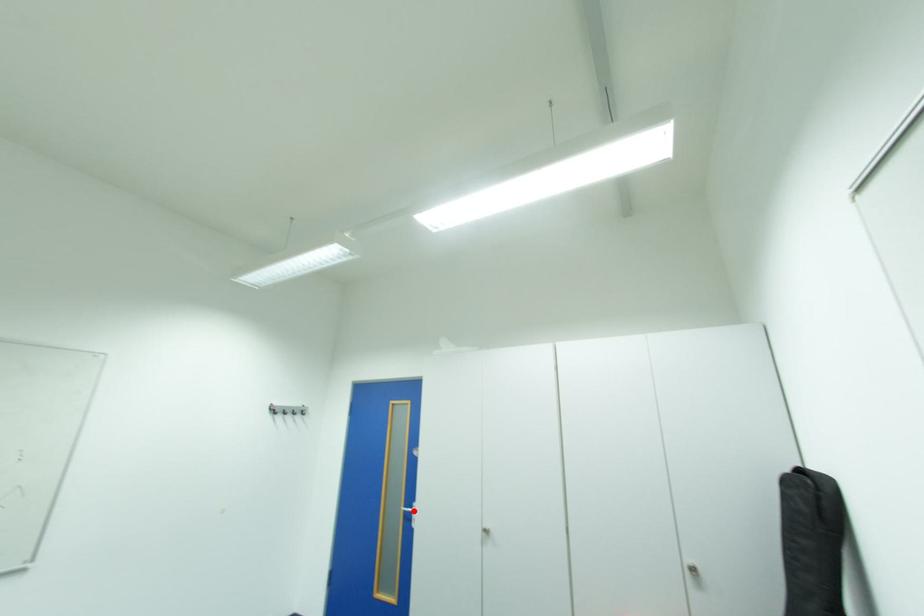
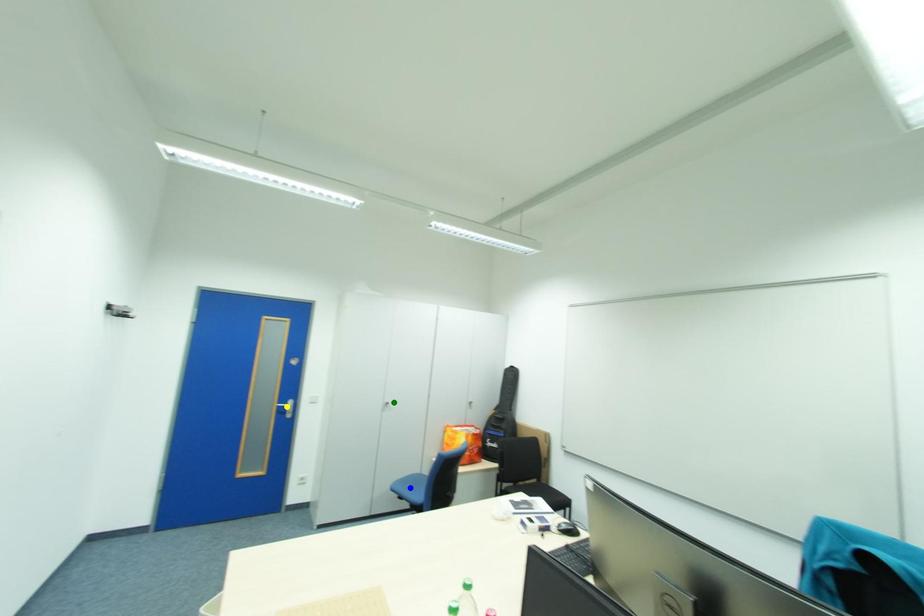
Question: I am providing you with two images of the same scene from different viewpoints. A red point is marked on the first image. You are given multiple points on the second image. Which point in image 2 represents the same 3d spot as the red point in image 1?

Choices:
 (A) yellow point
 (B) green point
 (C) blue point

Answer: (A)